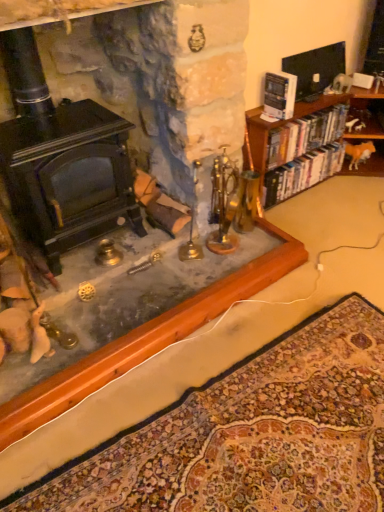
Find the location of `empty space that is ontop of black matte fireplace at left`. empty space that is ontop of black matte fireplace at left is located at coordinates click(x=56, y=122).